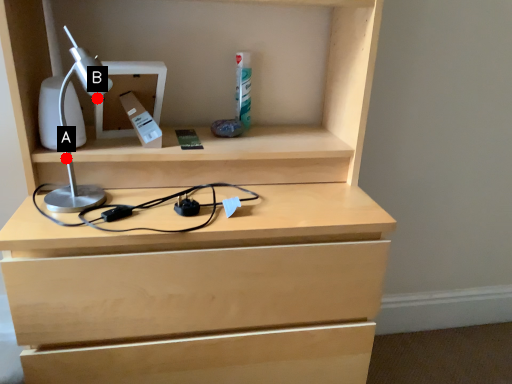
Question: Two points are circled on the image, labeled by A and B beside each circle. Which of the following is the farthest from the observer?

Choices:
 (A) A is further
 (B) B is further

Answer: (A)